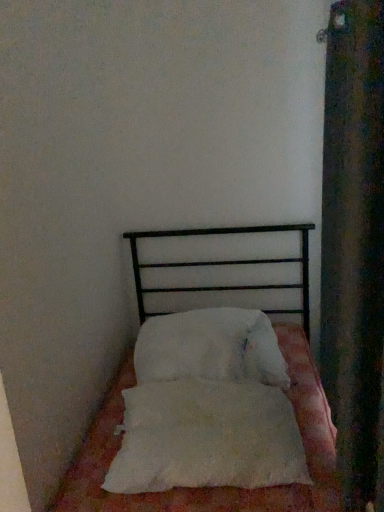
Describe the element at coordinates (291, 401) in the screenshot. I see `white soft bed at center` at that location.

Find the location of a particular element. The height and width of the screenshot is (512, 384). velvet dark green curtain at right is located at coordinates (354, 247).

At what (x,y) coordinates should I click in order to perform the action: click on curtain to the right of white fluffy pillow at center, which is counted as the first pillow, starting from the front. Please return your answer as a coordinate pair (x, y). The height and width of the screenshot is (512, 384). Looking at the image, I should click on (354, 247).

How many degrees apart are the facing directions of velvet dark green curtain at right and white fluffy pillow at center, which is counted as the first pillow, starting from the front?

There is a 93.6-degree angle between the facing directions of velvet dark green curtain at right and white fluffy pillow at center, which is counted as the first pillow, starting from the front.

From a real-world perspective, who is located higher, velvet dark green curtain at right or white fluffy pillow at center, which is counted as the first pillow, starting from the front?

velvet dark green curtain at right, from a real-world perspective.

Is white fluffy pillow at center, which is counted as the first pillow, starting from the front, at the back of velvet dark green curtain at right?

No.

Find the location of a particular element. This screenshot has width=384, height=512. pillow on the right of white fluffy pillow at center, which is counted as the first pillow, starting from the front is located at coordinates (210, 347).

From a real-world perspective, is white fluffy pillow at center, which is counted as the first pillow, starting from the front, physically above white fluffy pillow at center, arranged as the second pillow when viewed from the front?

Incorrect, from a real-world perspective, white fluffy pillow at center, which is counted as the first pillow, starting from the front, is lower than white fluffy pillow at center, arranged as the second pillow when viewed from the front.

Between white fluffy pillow at center, positioned as the second pillow in back-to-front order, and white fluffy pillow at center, arranged as the second pillow when viewed from the front, which one is positioned behind?

Positioned behind is white fluffy pillow at center, arranged as the second pillow when viewed from the front.

Between white fluffy pillow at center, positioned as the second pillow in back-to-front order, and white fluffy pillow at center, which ranks as the first pillow in back-to-front order, which one has larger width?

With larger width is white fluffy pillow at center, which ranks as the first pillow in back-to-front order.

Is white soft bed at center completely or partially outside of white fluffy pillow at center, which ranks as the first pillow in back-to-front order?

That's correct, white soft bed at center is outside of white fluffy pillow at center, which ranks as the first pillow in back-to-front order.

Looking at this image, from the image's perspective, is white soft bed at center over white fluffy pillow at center, arranged as the second pillow when viewed from the front?

Actually, white soft bed at center appears below white fluffy pillow at center, arranged as the second pillow when viewed from the front, in the image.

What's the angular difference between white soft bed at center and white fluffy pillow at center, which ranks as the first pillow in back-to-front order,'s facing directions?

The angle between the facing direction of white soft bed at center and the facing direction of white fluffy pillow at center, which ranks as the first pillow in back-to-front order, is 3.65 degrees.

Is white soft bed at center facing towards white fluffy pillow at center, which ranks as the first pillow in back-to-front order?

No, white soft bed at center is not oriented towards white fluffy pillow at center, which ranks as the first pillow in back-to-front order.

Does point (222, 311) lie behind point (152, 498)?

That is True.

How much distance is there between white fluffy pillow at center, arranged as the second pillow when viewed from the front, and white soft bed at center?

10.92 inches.

What's the angular difference between white fluffy pillow at center, which ranks as the first pillow in back-to-front order, and white soft bed at center's facing directions?

The facing directions of white fluffy pillow at center, which ranks as the first pillow in back-to-front order, and white soft bed at center are 3.65 degrees apart.

From the image's perspective, is white fluffy pillow at center, which ranks as the first pillow in back-to-front order, under white soft bed at center?

Actually, white fluffy pillow at center, which ranks as the first pillow in back-to-front order, appears above white soft bed at center in the image.

Where is `pillow that is above the white fluffy pillow at center, positioned as the second pillow in back-to-front order (from the image's perspective)`? The image size is (384, 512). pillow that is above the white fluffy pillow at center, positioned as the second pillow in back-to-front order (from the image's perspective) is located at coordinates (210, 347).

Considering the relative positions of white fluffy pillow at center, arranged as the second pillow when viewed from the front, and white fluffy pillow at center, positioned as the second pillow in back-to-front order, in the image provided, is white fluffy pillow at center, arranged as the second pillow when viewed from the front, to the left or to the right of white fluffy pillow at center, positioned as the second pillow in back-to-front order,?

white fluffy pillow at center, arranged as the second pillow when viewed from the front, is positioned on white fluffy pillow at center, positioned as the second pillow in back-to-front order,'s right side.

From a real-world perspective, is white fluffy pillow at center, arranged as the second pillow when viewed from the front, positioned above or below white fluffy pillow at center, which is counted as the first pillow, starting from the front?

white fluffy pillow at center, arranged as the second pillow when viewed from the front, is situated higher than white fluffy pillow at center, which is counted as the first pillow, starting from the front, in the real world.

Between white fluffy pillow at center, which ranks as the first pillow in back-to-front order, and white fluffy pillow at center, positioned as the second pillow in back-to-front order, which one has smaller width?

With smaller width is white fluffy pillow at center, positioned as the second pillow in back-to-front order.

Is white fluffy pillow at center, which is counted as the first pillow, starting from the front, further to the viewer compared to white soft bed at center?

Yes, it is behind white soft bed at center.

Is white fluffy pillow at center, which is counted as the first pillow, starting from the front, positioned beyond the bounds of white soft bed at center?

→ No, white fluffy pillow at center, which is counted as the first pillow, starting from the front, is not entirely external to white soft bed at center.

Considering the relative sizes of white fluffy pillow at center, which is counted as the first pillow, starting from the front, and white soft bed at center in the image provided, is white fluffy pillow at center, which is counted as the first pillow, starting from the front, smaller than white soft bed at center?

Yes.

Considering the sizes of objects white fluffy pillow at center, positioned as the second pillow in back-to-front order, and white soft bed at center in the image provided, who is shorter, white fluffy pillow at center, positioned as the second pillow in back-to-front order, or white soft bed at center?

white fluffy pillow at center, positioned as the second pillow in back-to-front order, is shorter.

Is white fluffy pillow at center, positioned as the second pillow in back-to-front order, behind velvet dark green curtain at right?

Yes, it is behind velvet dark green curtain at right.

Is white fluffy pillow at center, positioned as the second pillow in back-to-front order, bigger than velvet dark green curtain at right?

Actually, white fluffy pillow at center, positioned as the second pillow in back-to-front order, might be smaller than velvet dark green curtain at right.

Is white fluffy pillow at center, which is counted as the first pillow, starting from the front, directly adjacent to velvet dark green curtain at right?

No, white fluffy pillow at center, which is counted as the first pillow, starting from the front, is not making contact with velvet dark green curtain at right.

Locate an element on the screen. curtain above the white fluffy pillow at center, positioned as the second pillow in back-to-front order (from the image's perspective) is located at coordinates (354, 247).

At what (x,y) coordinates should I click in order to perform the action: click on pillow on the right of white fluffy pillow at center, which is counted as the first pillow, starting from the front. Please return your answer as a coordinate pair (x, y). Looking at the image, I should click on (210, 347).

Looking at the image, which one is located further to white fluffy pillow at center, positioned as the second pillow in back-to-front order, white soft bed at center or velvet dark green curtain at right?

Based on the image, velvet dark green curtain at right appears to be further to white fluffy pillow at center, positioned as the second pillow in back-to-front order.

Considering their positions, is velvet dark green curtain at right positioned further to white fluffy pillow at center, which is counted as the first pillow, starting from the front, than white soft bed at center?

velvet dark green curtain at right.

When comparing their distances from velvet dark green curtain at right, does white fluffy pillow at center, which ranks as the first pillow in back-to-front order, or white soft bed at center seem closer?

Among the two, white fluffy pillow at center, which ranks as the first pillow in back-to-front order, is located nearer to velvet dark green curtain at right.

Which object lies nearer to the anchor point velvet dark green curtain at right, white fluffy pillow at center, positioned as the second pillow in back-to-front order, or white fluffy pillow at center, which ranks as the first pillow in back-to-front order?

Among the two, white fluffy pillow at center, positioned as the second pillow in back-to-front order, is located nearer to velvet dark green curtain at right.

Based on their spatial positions, is white fluffy pillow at center, which is counted as the first pillow, starting from the front, or white soft bed at center further from white fluffy pillow at center, arranged as the second pillow when viewed from the front?

Based on the image, white soft bed at center appears to be further to white fluffy pillow at center, arranged as the second pillow when viewed from the front.

Considering their positions, is white fluffy pillow at center, which is counted as the first pillow, starting from the front, positioned closer to velvet dark green curtain at right than white soft bed at center?

Among the two, white fluffy pillow at center, which is counted as the first pillow, starting from the front, is located nearer to velvet dark green curtain at right.

In the scene shown: From the image, which object appears to be nearer to white soft bed at center, velvet dark green curtain at right or white fluffy pillow at center, which is counted as the first pillow, starting from the front?

white fluffy pillow at center, which is counted as the first pillow, starting from the front.

When comparing their distances from white fluffy pillow at center, which ranks as the first pillow in back-to-front order, does white fluffy pillow at center, positioned as the second pillow in back-to-front order, or velvet dark green curtain at right seem closer?

white fluffy pillow at center, positioned as the second pillow in back-to-front order, is positioned closer to the anchor white fluffy pillow at center, which ranks as the first pillow in back-to-front order.

Locate an element on the screen. bed between velvet dark green curtain at right and white fluffy pillow at center, which ranks as the first pillow in back-to-front order, along the z-axis is located at coordinates click(291, 401).

At what (x,y) coordinates should I click in order to perform the action: click on pillow between velvet dark green curtain at right and white fluffy pillow at center, arranged as the second pillow when viewed from the front, along the z-axis. Please return your answer as a coordinate pair (x, y). The width and height of the screenshot is (384, 512). Looking at the image, I should click on click(x=206, y=438).

I want to click on pillow between white soft bed at center and white fluffy pillow at center, arranged as the second pillow when viewed from the front, from front to back, so click(206, 438).

I want to click on bed between velvet dark green curtain at right and white fluffy pillow at center, which is counted as the first pillow, starting from the front, in the front-back direction, so click(x=291, y=401).